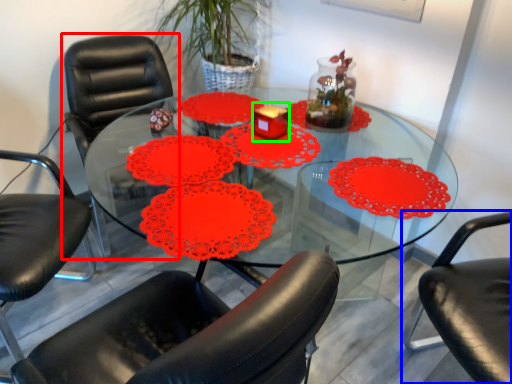
Question: Estimate the real-world distances between objects in this image. Which object is closer to chair (highlighted by a red box), chair (highlighted by a blue box) or candle holder (highlighted by a green box)?

Choices:
 (A) chair
 (B) candle holder

Answer: (B)